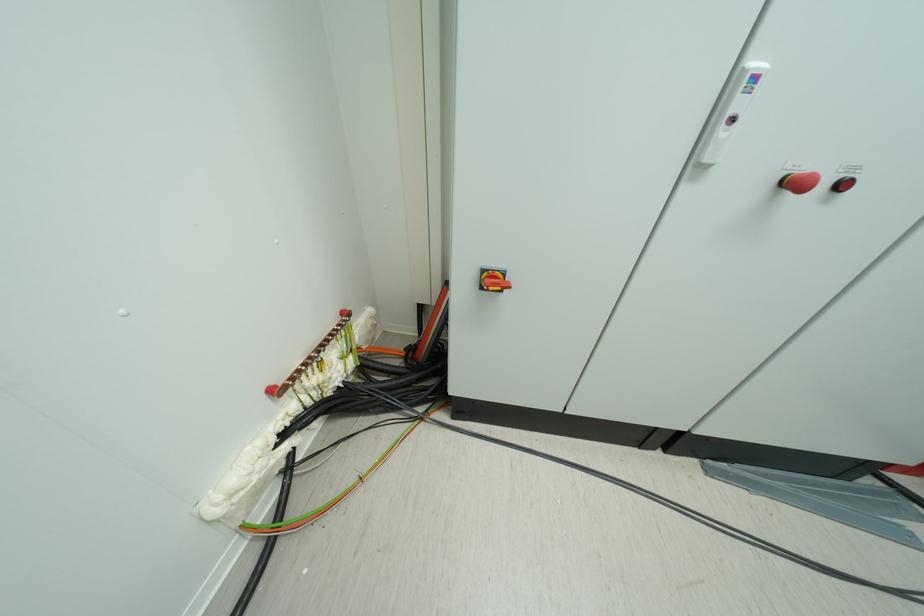
You are a GUI agent. You are given a task and a screenshot of the screen. Output one action in this format:
    pyautogui.click(x=<x>, y=<y>)
    Task: Click on the red and yellow switch
    This screenshot has height=616, width=924.
    Given the screenshot: What is the action you would take?
    (493, 280)